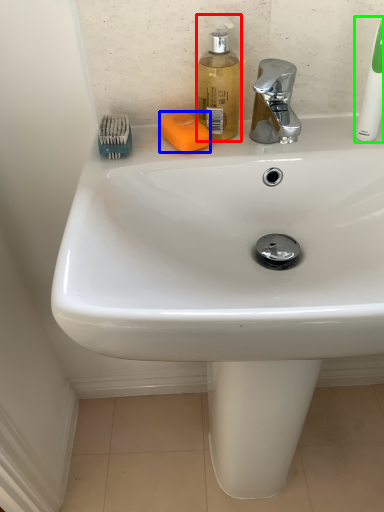
Question: Which is nearer to the soap dispenser (highlighted by a red box)? soap (highlighted by a blue box) or toothbrush (highlighted by a green box).

Choices:
 (A) soap
 (B) toothbrush

Answer: (A)